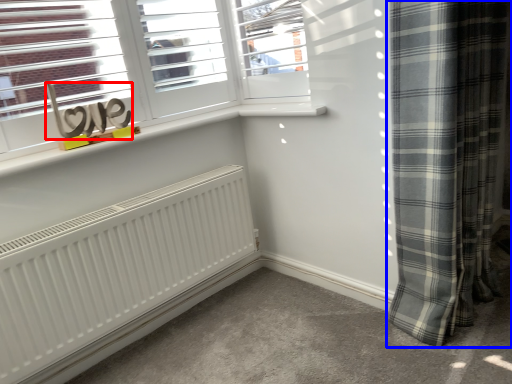
Question: Among these objects, which one is nearest to the camera, writing (highlighted by a red box) or curtain (highlighted by a blue box)?

Choices:
 (A) writing
 (B) curtain

Answer: (B)